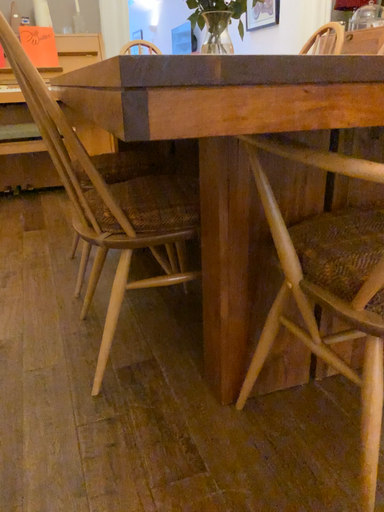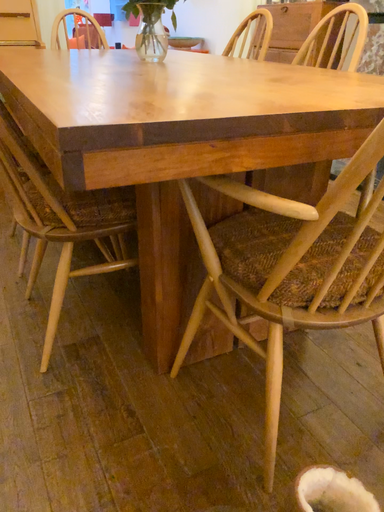
Question: Which way did the camera rotate in the video?

Choices:
 (A) rotated left
 (B) rotated right

Answer: (B)